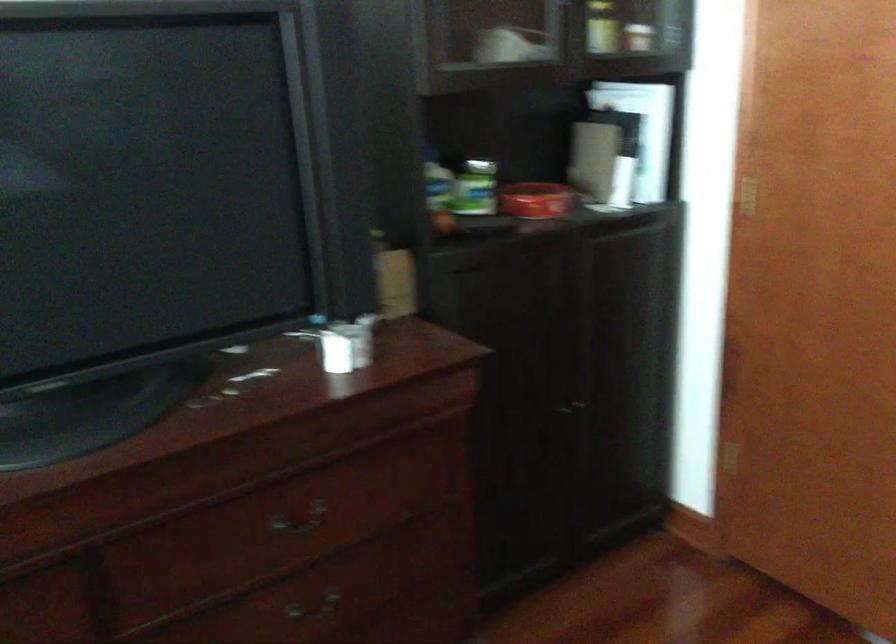
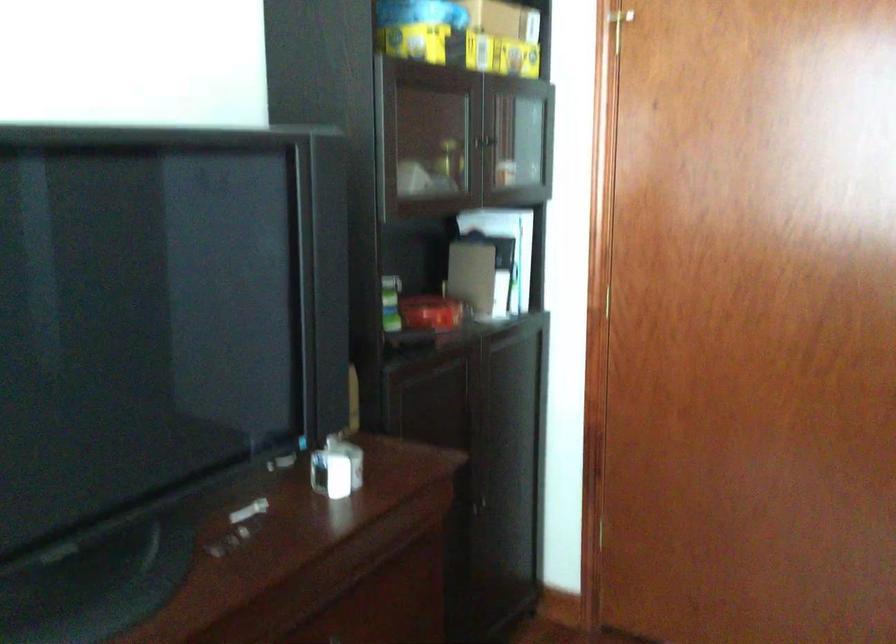
Question: The camera is either moving clockwise (left) or counter-clockwise (right) around the object. The first image is from the beginning of the video and the second image is from the end. Is the camera moving left or right when shooting the video?

Choices:
 (A) Left
 (B) Right

Answer: (A)